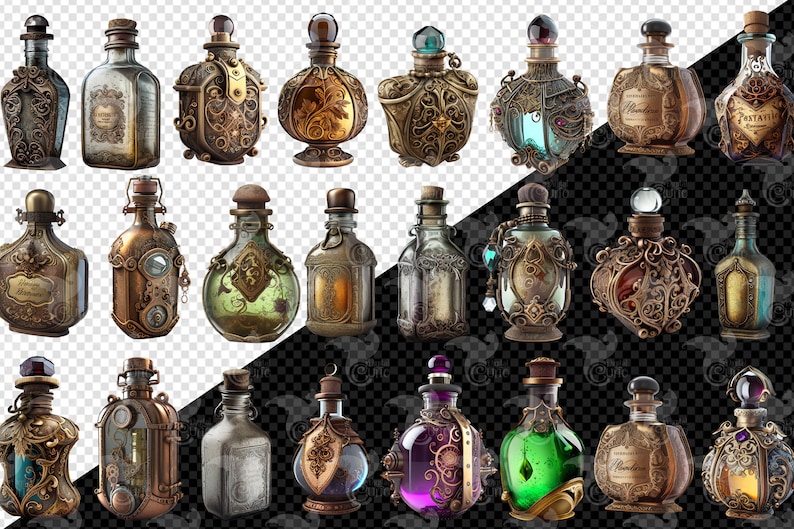
What are the coordinates of `gray and white diamond shaped background` in the screenshot? It's located at (288, 183).